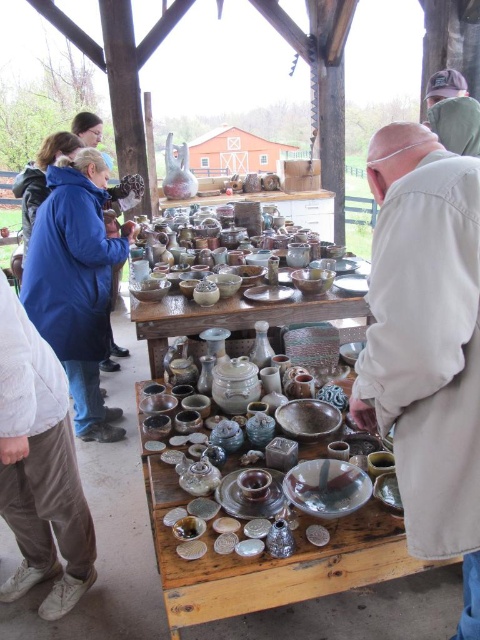
You are a customer at the pottery sale and want to buy both the beige fabric shirt at right and the green fabric cap at upper right. However, you have a small backpack with limited space. Based on their sizes, which item should you place first into your backpack to ensure both fit?

The beige fabric shirt at right is larger in size than the green fabric cap at upper right, so you should place the beige fabric shirt at right first to make space for the smaller green fabric cap at upper right.

You are standing in front of the pottery exhibition and want to touch the beige fabric shirt at right. Considering your arm can reach 1 meter, can you reach it?

The beige fabric shirt at right is 1.01 meters from viewer, so your arm can only reach 1 meter. You cannot reach the beige fabric shirt at right.